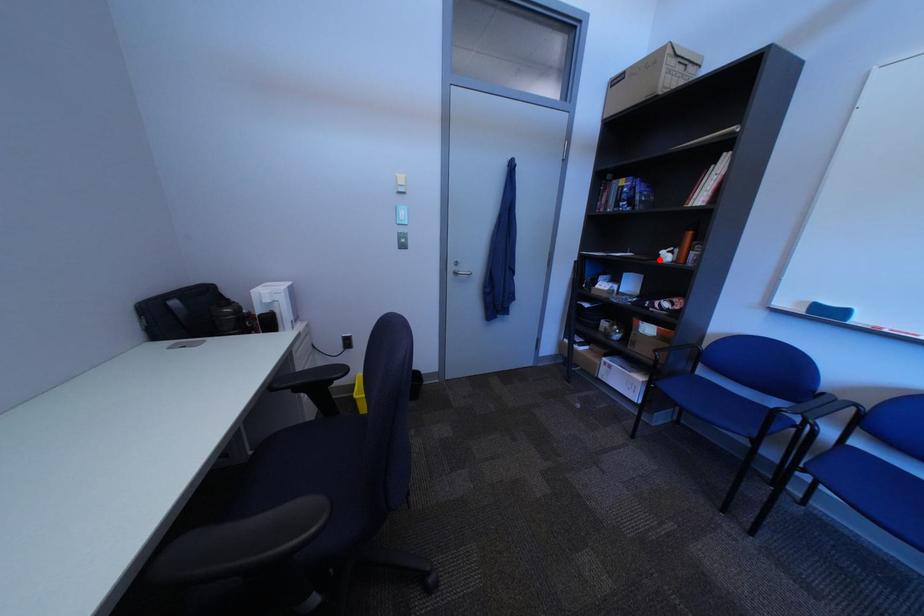
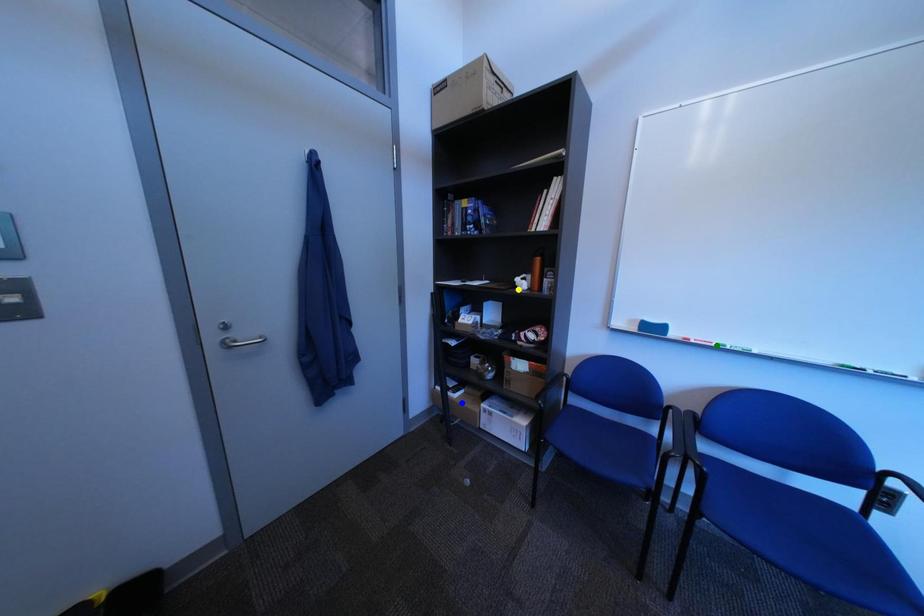
Question: I am providing you with two images of the same scene from different viewpoints. A red point is marked on the first image. You are given multiple points on the second image. In image 2, which mark is for the same physical point as the one in image 1?

Choices:
 (A) yellow point
 (B) green point
 (C) blue point

Answer: (A)